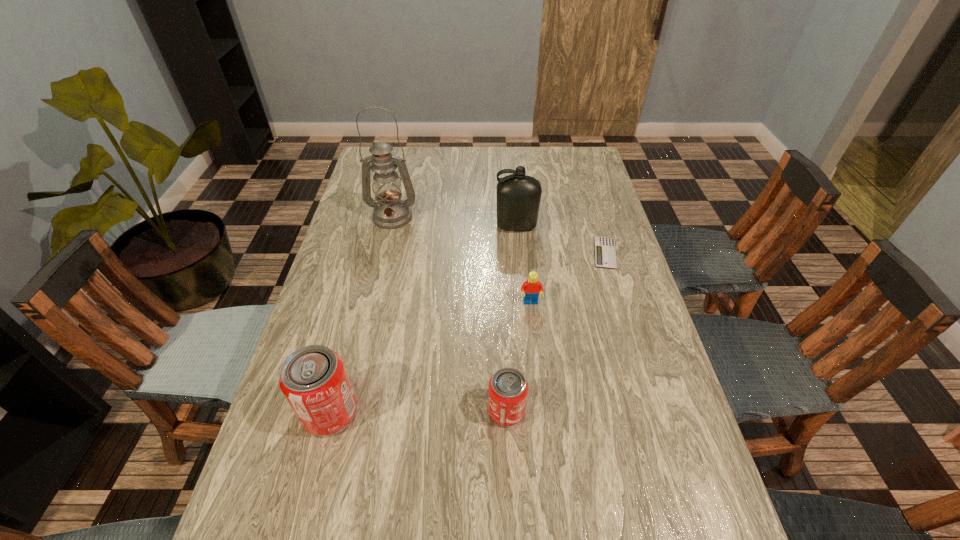
Find the location of a particular element. vacant area at the far right corner of the desktop is located at coordinates (555, 148).

The width and height of the screenshot is (960, 540). In order to click on unoccupied position between the oil lamp and the fifth shortest object in this screenshot , I will do `click(454, 222)`.

What are the coordinates of `free space between the oil lamp and the third nearest object` in the screenshot? It's located at (462, 260).

The image size is (960, 540). Find the location of `vacant area that lies between the taller can and the shorter can`. vacant area that lies between the taller can and the shorter can is located at coordinates (419, 411).

At what (x,y) coordinates should I click in order to perform the action: click on free space between the rightmost object and the left can. Please return your answer as a coordinate pair (x, y). The width and height of the screenshot is (960, 540). Looking at the image, I should click on (468, 333).

Find the location of a particular element. free spot between the shorter can and the oil lamp is located at coordinates (449, 314).

Find the location of a particular element. The height and width of the screenshot is (540, 960). free space that is in between the Lego and the right can is located at coordinates (518, 357).

Locate an element on the screen. The image size is (960, 540). free space between the fifth shortest object and the left can is located at coordinates (423, 319).

The width and height of the screenshot is (960, 540). In order to click on free space between the oil lamp and the fourth nearest object in this screenshot , I will do `click(499, 235)`.

You are a GUI agent. You are given a task and a screenshot of the screen. Output one action in this format:
    pyautogui.click(x=<x>, y=<y>)
    Task: Click on the free space between the bottle and the Lego
    
    Given the screenshot: What is the action you would take?
    pyautogui.click(x=523, y=265)